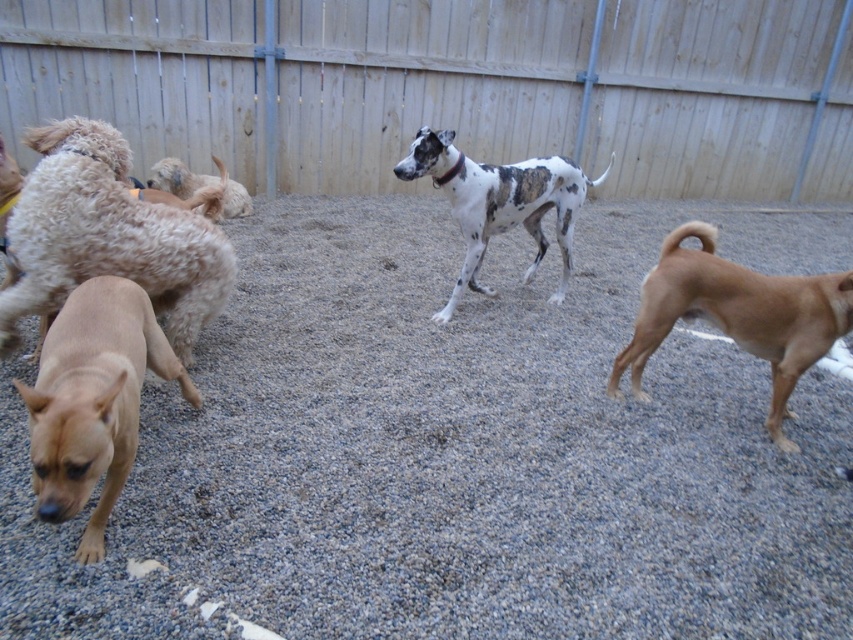
From the picture: You are a dog owner trying to find space for your new puppy. You see the light brown fluffy dog at left and the fuzzy beige dog at upper left. Which dog takes up more area in the image?

The fuzzy beige dog at upper left takes up more area in the image than the light brown fluffy dog at left.

Based on the coordinates provided, can you identify which dog is positioned at point (107, 236)?

The light brown fluffy dog at left is positioned at point (107, 236).

You are a photographer trying to capture a group photo of the brown matte dog at lower left and the fuzzy beige dog at upper left. Which dog should you focus on if you want to include both in the frame without cropping either?

You should focus on the fuzzy beige dog at upper left because the brown matte dog at lower left occupies less space, making it easier to fit both into the frame without cropping.